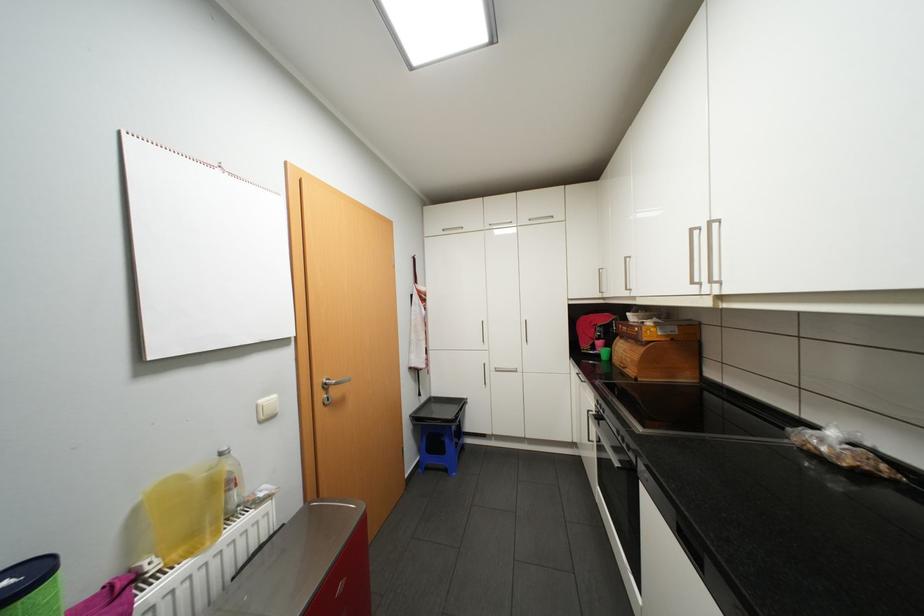
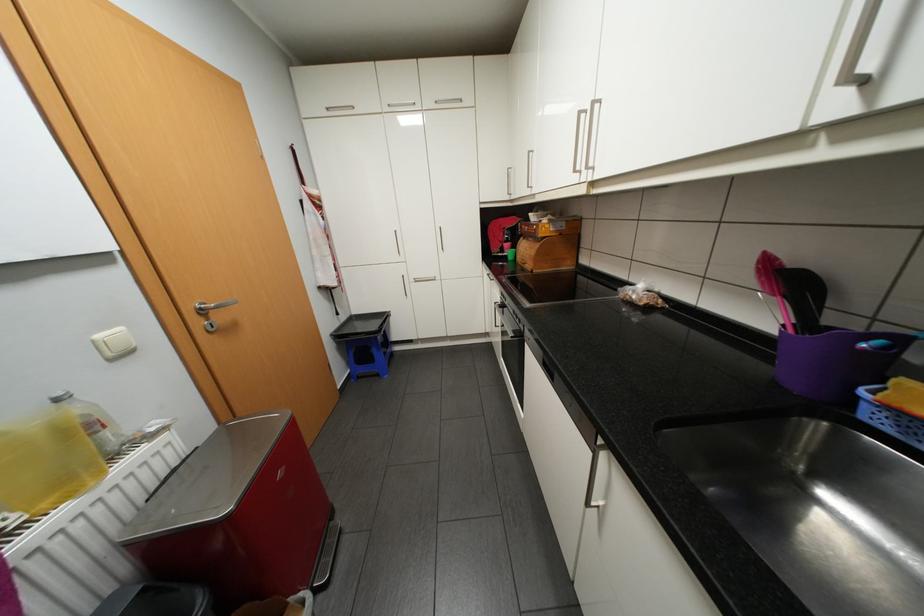
Locate, in the second image, the point that corresponds to (x=451, y=229) in the first image.

(335, 108)